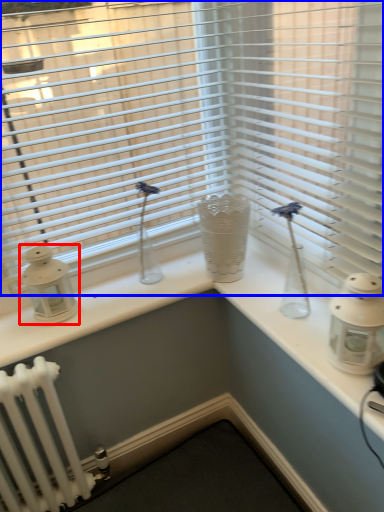
Question: Which object appears farthest to the camera in this image, candle holder (highlighted by a red box) or window blind (highlighted by a blue box)?

Choices:
 (A) candle holder
 (B) window blind

Answer: (A)